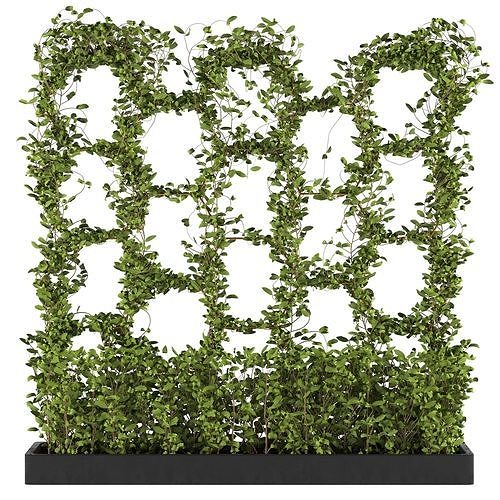
I want to click on left corner of planter box, so click(25, 466).